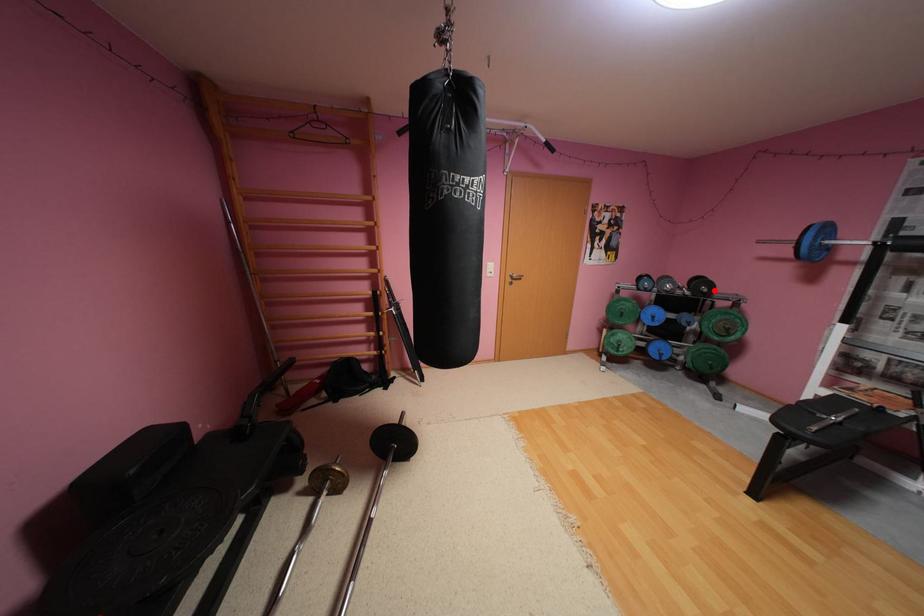
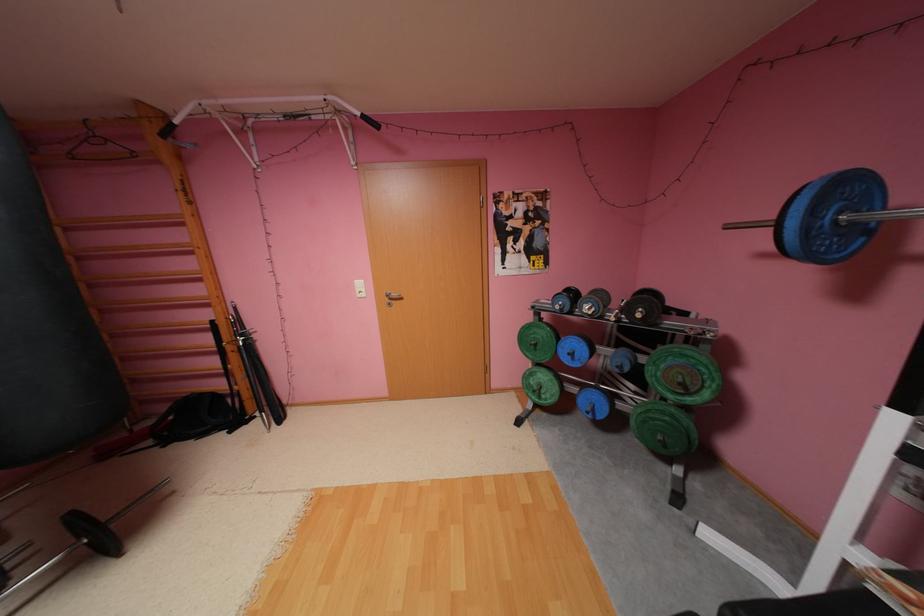
The point at the highlighted location is marked in the first image. Where is the corresponding point in the second image?

(648, 315)